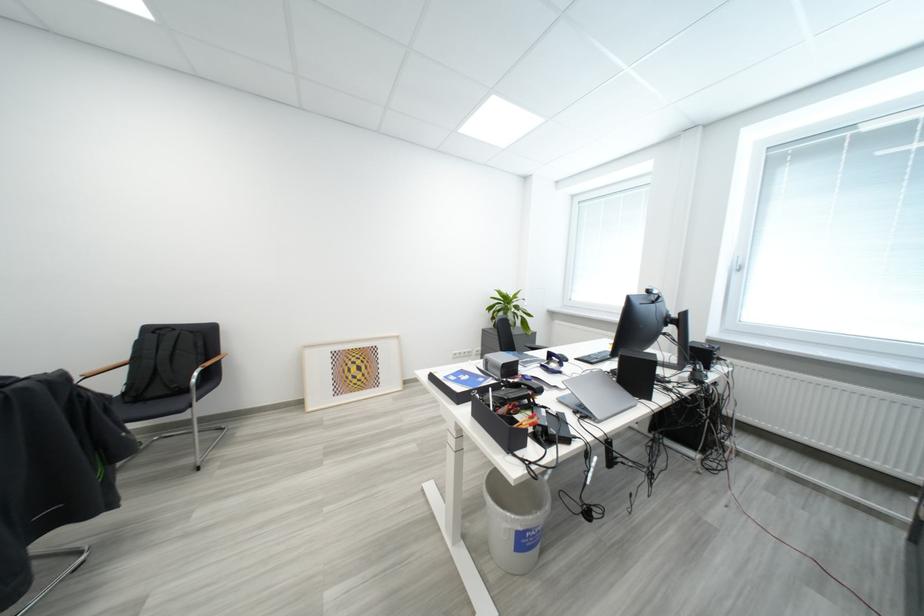
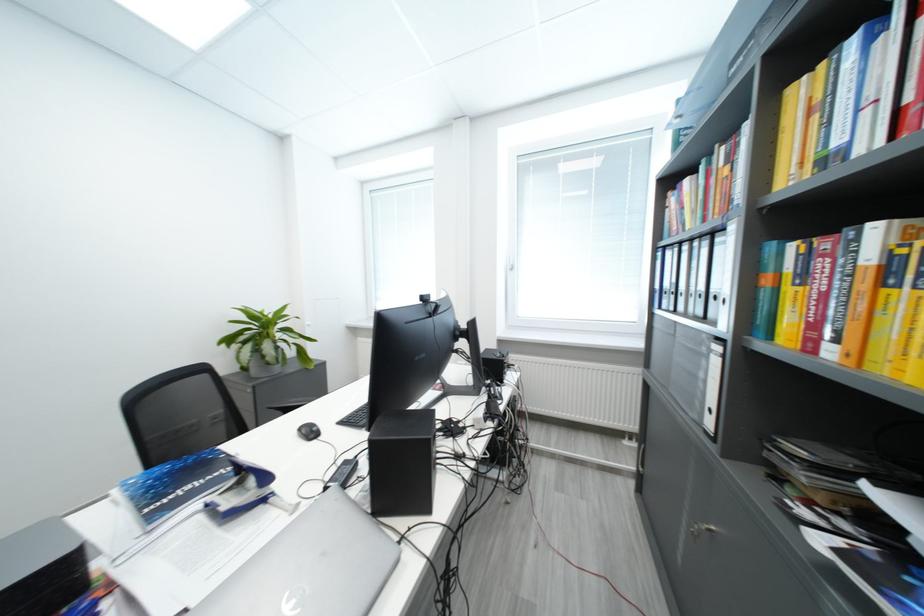
In the second image, find the point that corresponds to the point at 506,310 in the first image.

(251, 341)